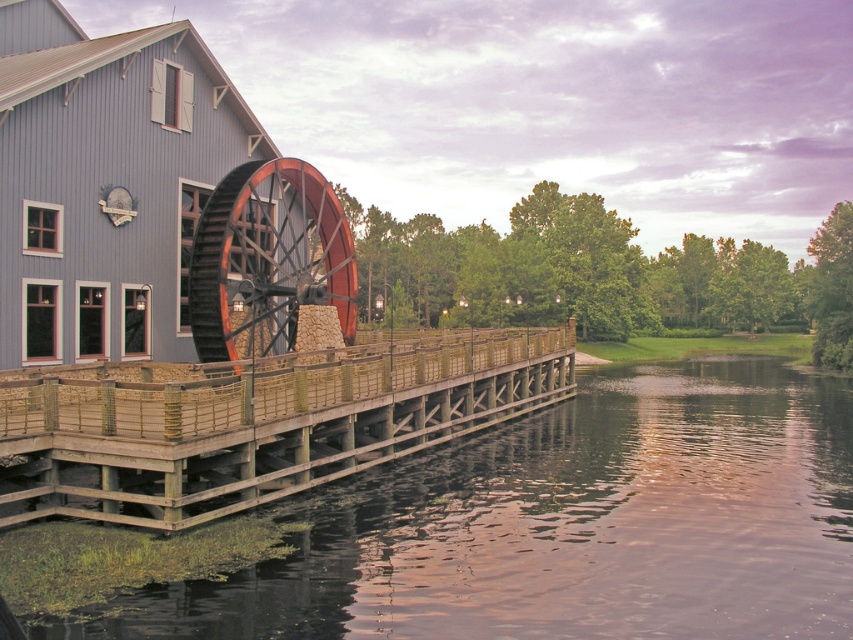
From the picture: You are standing on the wooden dock at lower left and want to cross to the other side of the smooth dark water at center. Can you see the far bank clearly from your current position?

The smooth dark water at center is shorter than wooden dock at lower left, so the water is narrower than the dock. Since the water is only as wide as the dock, you can likely see the far bank clearly from the wooden dock at lower left.

You are standing at the point labeled as point (x=251, y=422) in the image. What object are you currently standing on?

You are standing on the wooden dock at lower left, as point (x=251, y=422) corresponds to wooden dock at lower left.

You are standing on the wooden dock at lower left and want to observe the wooden waterwheel at center. Which object is taller when viewed from your current position?

The wooden waterwheel at center is taller than the wooden dock at lower left.